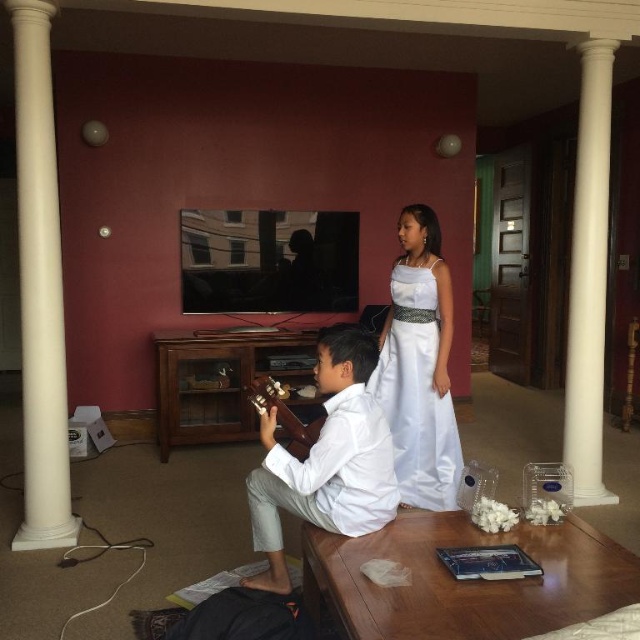
Question: Which is farther from the white matte shirt at center?

Choices:
 (A) wooden table at lower center
 (B) brown wooden guitar at center
 (C) white satin dress at center

Answer: (C)

Question: Among these points, which one is farthest from the camera?

Choices:
 (A) (269, 515)
 (B) (576, 444)
 (C) (410, 401)

Answer: (B)

Question: Does white matte shirt at center appear on the right side of white satin dress at center?

Choices:
 (A) no
 (B) yes

Answer: (A)

Question: Can you confirm if wooden table at lower center is smaller than white smooth column at right?

Choices:
 (A) no
 (B) yes

Answer: (B)

Question: Which object is positioned farthest from the wooden table at lower center?

Choices:
 (A) brown wooden guitar at center
 (B) white smooth column at right
 (C) white satin dress at center

Answer: (B)

Question: Can you confirm if wooden table at lower center is positioned to the left of white matte shirt at center?

Choices:
 (A) yes
 (B) no

Answer: (B)